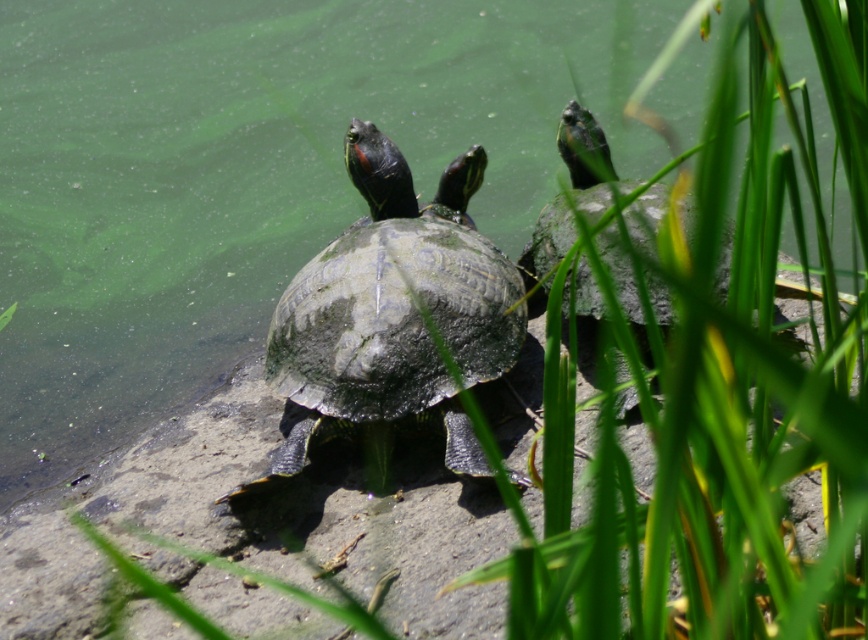
Question: Which of the following is the closest to the observer?

Choices:
 (A) (663, 289)
 (B) (464, 460)

Answer: (B)

Question: Can you confirm if green scaly tortoise at center is positioned above green scaly tortoise at upper right?

Choices:
 (A) yes
 (B) no

Answer: (B)

Question: Is green scaly tortoise at center to the left of green scaly tortoise at upper right from the viewer's perspective?

Choices:
 (A) no
 (B) yes

Answer: (B)

Question: Which point is farther from the camera taking this photo?

Choices:
 (A) (628, 253)
 (B) (469, 420)

Answer: (B)

Question: Does green scaly tortoise at center appear on the right side of green scaly tortoise at upper right?

Choices:
 (A) yes
 (B) no

Answer: (B)

Question: Which of the following is the closest to the observer?

Choices:
 (A) green scaly tortoise at upper right
 (B) green scaly tortoise at center

Answer: (A)